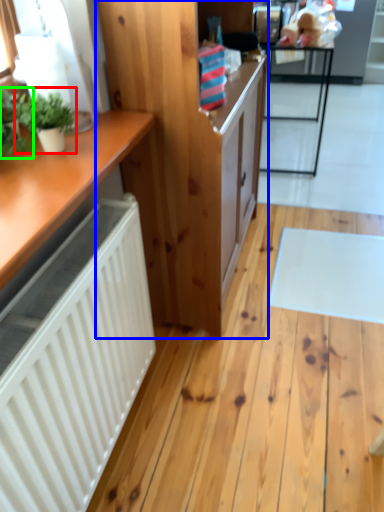
Question: Which object is positioned closest to houseplant (highlighted by a red box)? Select from cabinetry (highlighted by a blue box) and houseplant (highlighted by a green box).

Choices:
 (A) cabinetry
 (B) houseplant

Answer: (B)